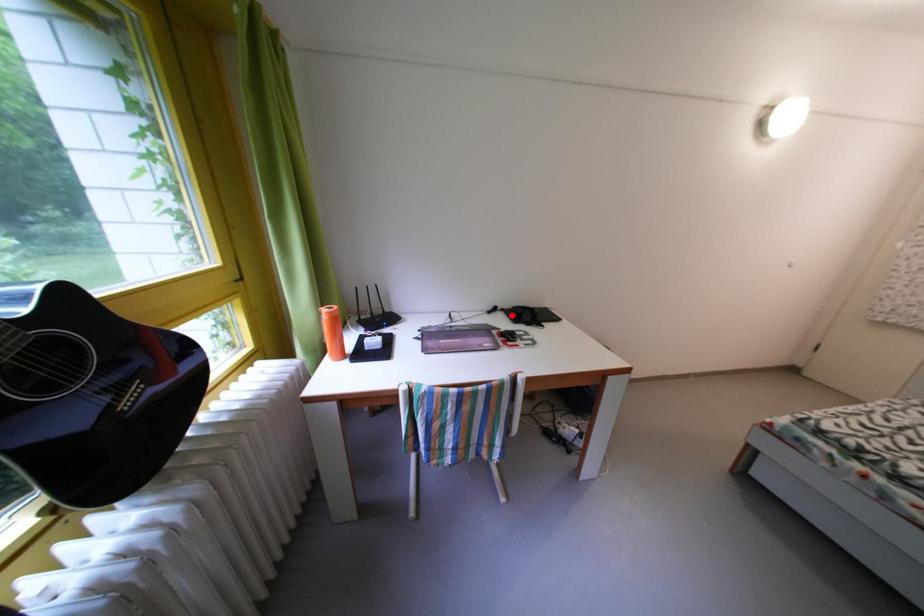
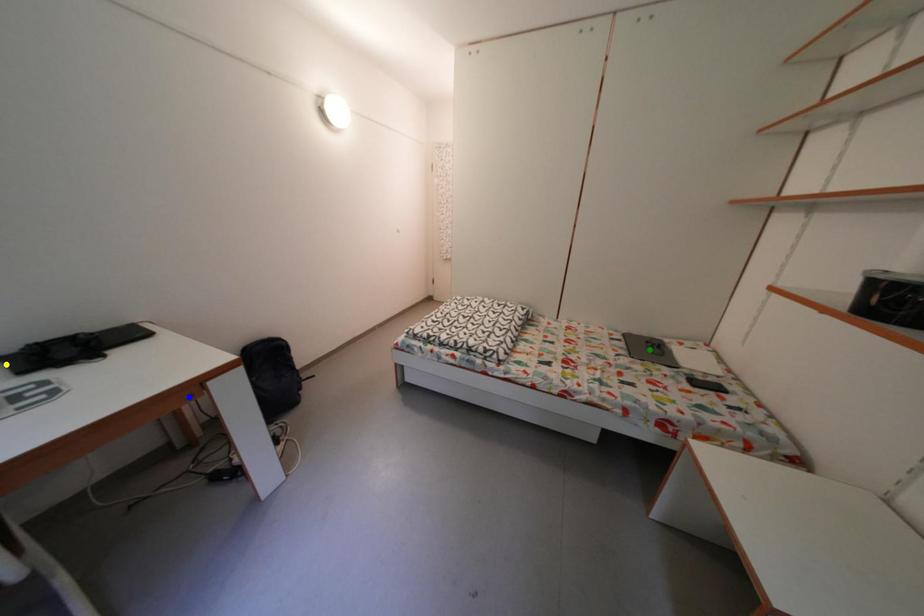
Question: I am providing you with two images of the same scene from different viewpoints. A red point is marked on the first image. You are given multiple points on the second image. Which point in image 2 is actually the same real-world point as the red point in image 1?

Choices:
 (A) yellow point
 (B) blue point
 (C) green point

Answer: (A)